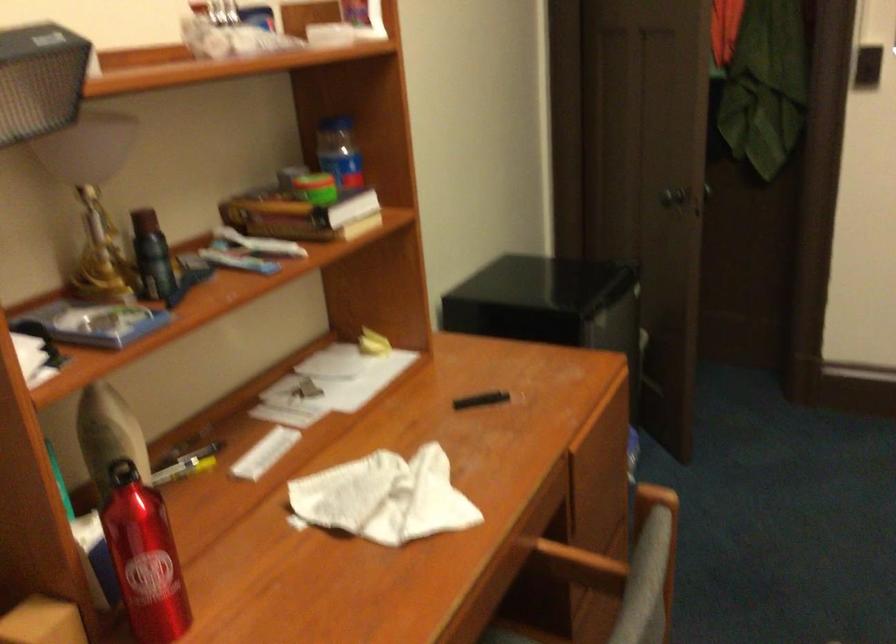
Image resolution: width=896 pixels, height=644 pixels. Describe the element at coordinates (666, 194) in the screenshot. I see `a door knob` at that location.